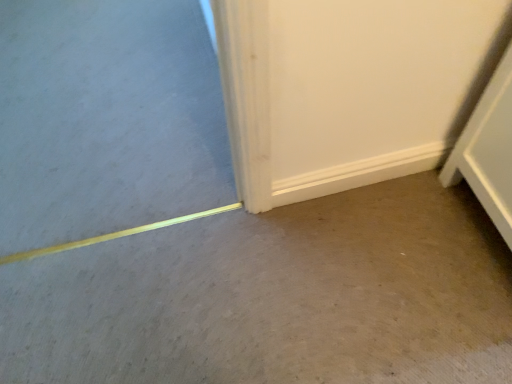
Where is `brown matte concrete at lower center`? The height and width of the screenshot is (384, 512). brown matte concrete at lower center is located at coordinates (275, 297).

What is the approximate width of brown matte concrete at lower center?

The width of brown matte concrete at lower center is 64.11 centimeters.

What do you see at coordinates (275, 297) in the screenshot? The height and width of the screenshot is (384, 512). I see `brown matte concrete at lower center` at bounding box center [275, 297].

The width and height of the screenshot is (512, 384). I want to click on brown matte concrete at lower center, so click(275, 297).